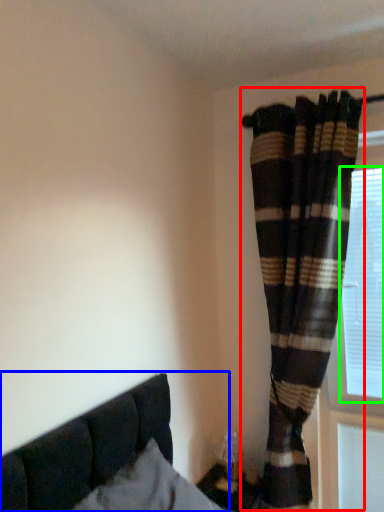
Question: Which object is positioned closest to curtain (highlighted by a red box)? Select from bed (highlighted by a blue box) and bay window (highlighted by a green box).

Choices:
 (A) bed
 (B) bay window

Answer: (B)